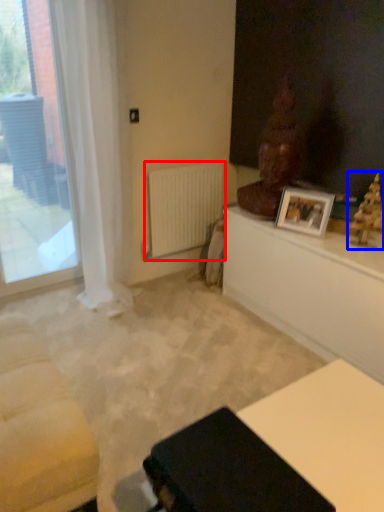
Question: Among these objects, which one is farthest to the camera, radiator (highlighted by a red box) or sculpture (highlighted by a blue box)?

Choices:
 (A) radiator
 (B) sculpture

Answer: (A)